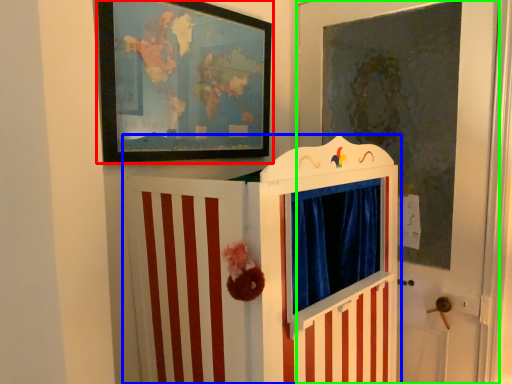
Question: Based on their relative distances, which object is farther from picture frame (highlighted by a red box)? Choose from furniture (highlighted by a blue box) and door (highlighted by a green box).

Choices:
 (A) furniture
 (B) door

Answer: (B)